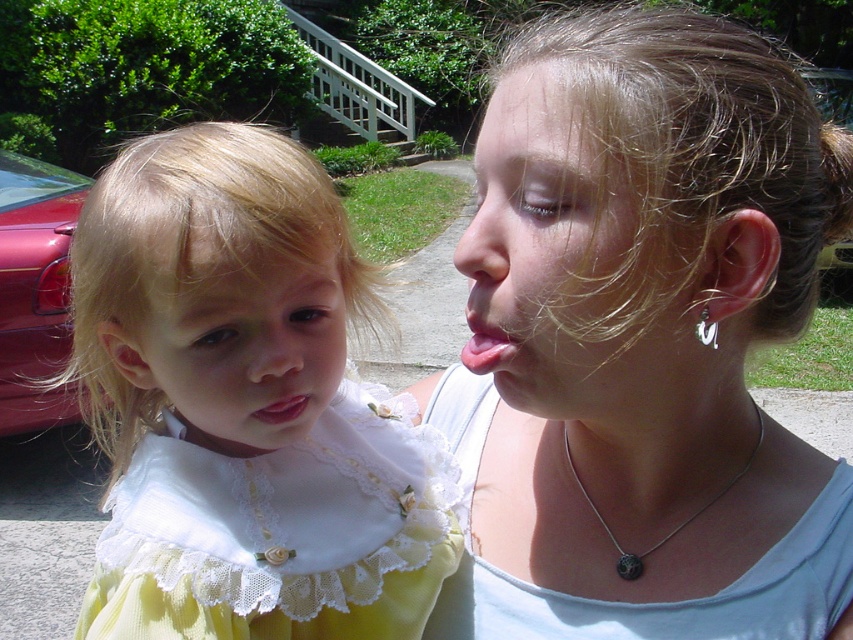
Question: Which of the following is the farthest from the observer?

Choices:
 (A) (204, 358)
 (B) (351, 573)

Answer: (B)

Question: Can you confirm if yellow lace dress at center is wider than white lace dress at center?

Choices:
 (A) no
 (B) yes

Answer: (A)

Question: Considering the relative positions of matte white dress at center and pink glossy tongue at center in the image provided, where is matte white dress at center located with respect to pink glossy tongue at center?

Choices:
 (A) above
 (B) below

Answer: (B)

Question: Which object appears farthest from the camera in this image?

Choices:
 (A) yellow lace dress at left
 (B) pink glossy tongue at center
 (C) satin white blouse at upper right

Answer: (A)

Question: Among these objects, which one is farthest from the camera?

Choices:
 (A) satin white blouse at upper right
 (B) matte pink lips at center
 (C) yellow lace dress at left

Answer: (B)

Question: Is silver/black pendant at center smaller than matte pink lips at center?

Choices:
 (A) no
 (B) yes

Answer: (A)